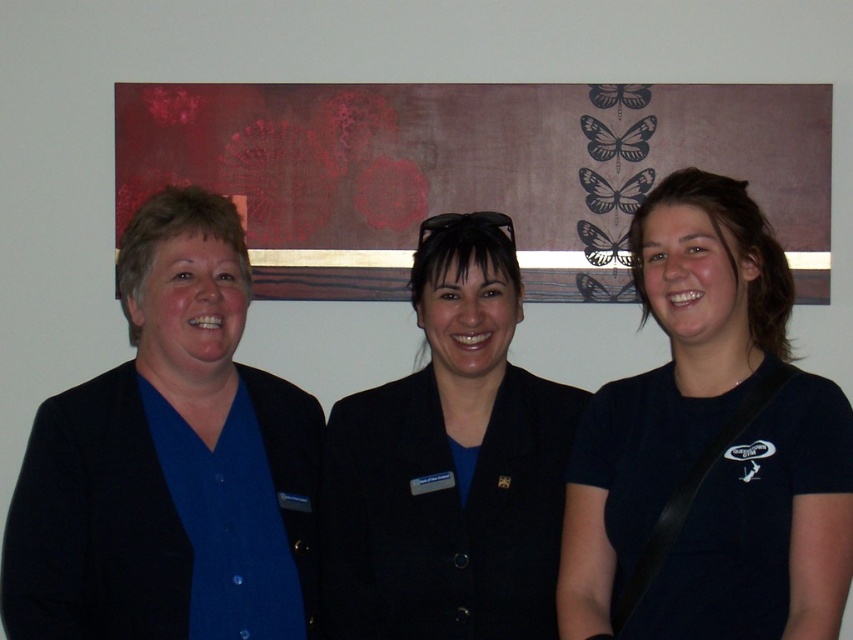
Which of these two, black matte shirt at center or black matte blazer at center, stands taller?

black matte shirt at center is taller.

What do you see at coordinates (709, 449) in the screenshot? The height and width of the screenshot is (640, 853). I see `black matte shirt at center` at bounding box center [709, 449].

Locate an element on the screen. This screenshot has width=853, height=640. black matte shirt at center is located at coordinates (709, 449).

You are a GUI agent. You are given a task and a screenshot of the screen. Output one action in this format:
    pyautogui.click(x=<x>, y=<y>)
    Task: Click on the blue matte shirt at center
    
    Given the screenshot: What is the action you would take?
    pyautogui.click(x=167, y=461)

Is blue matte shirt at center above black matte blazer at center?

Yes, blue matte shirt at center is above black matte blazer at center.

Between point (109, 493) and point (436, 556), which one is positioned in front?

Point (109, 493) is more forward.

This screenshot has width=853, height=640. I want to click on blue matte shirt at center, so click(167, 461).

Is black matte shirt at center behind blue matte shirt at center?

No, it is not.

Is black matte shirt at center to the left of blue matte shirt at center from the viewer's perspective?

No, black matte shirt at center is not to the left of blue matte shirt at center.

Which is behind, point (640, 480) or point (222, 259)?

Point (222, 259)

Locate an element on the screen. Image resolution: width=853 pixels, height=640 pixels. black matte shirt at center is located at coordinates (709, 449).